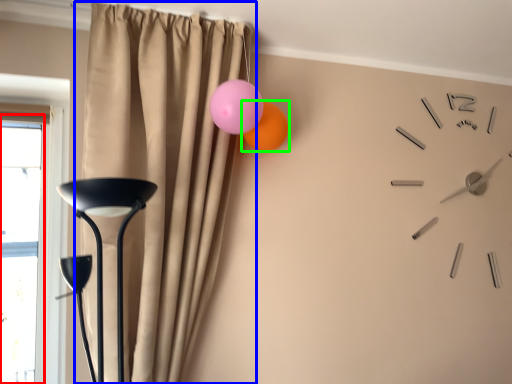
Question: Estimate the real-world distances between objects in this image. Which object is farther from window (highlighted by a red box), curtain (highlighted by a blue box) or balloon (highlighted by a green box)?

Choices:
 (A) curtain
 (B) balloon

Answer: (B)